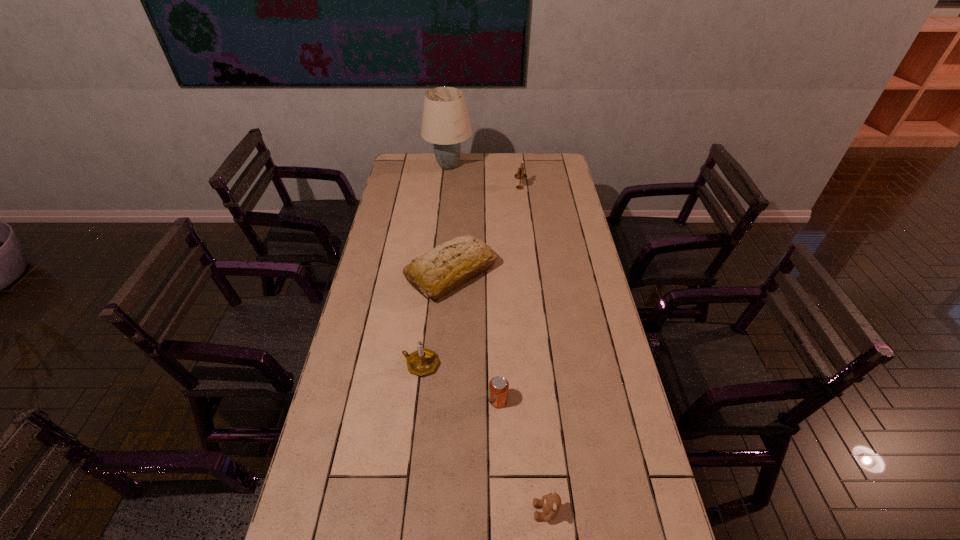
The width and height of the screenshot is (960, 540). What are the coordinates of `object that is at the far left corner` in the screenshot? It's located at point(445,122).

You are a GUI agent. You are given a task and a screenshot of the screen. Output one action in this format:
    pyautogui.click(x=<x>, y=<y>)
    Task: Click on the free space at the far edge
    The height and width of the screenshot is (540, 960).
    Given the screenshot: What is the action you would take?
    pyautogui.click(x=525, y=168)

Where is `vacant space at the left edge of the desktop`? The height and width of the screenshot is (540, 960). vacant space at the left edge of the desktop is located at coordinates (327, 436).

Locate an element on the screen. The width and height of the screenshot is (960, 540). vacant space at the right edge is located at coordinates (582, 279).

Image resolution: width=960 pixels, height=540 pixels. In the image, there is a desktop. Identify the location of vacant space at the far right corner. tap(550, 160).

Find the location of `unoccupied area between the nearest object and the left candle holder`. unoccupied area between the nearest object and the left candle holder is located at coordinates (484, 438).

I want to click on free spot between the teddy bear and the second nearest object, so click(522, 456).

Find the location of a particular element. Image resolution: width=960 pixels, height=540 pixels. vacant space that's between the nearer candle holder and the teddy bear is located at coordinates (484, 438).

Identify the location of blank region between the tallest object and the can. (473, 284).

Find the location of a particular element. The width and height of the screenshot is (960, 540). free space that is in between the bread and the farther candle holder is located at coordinates (486, 231).